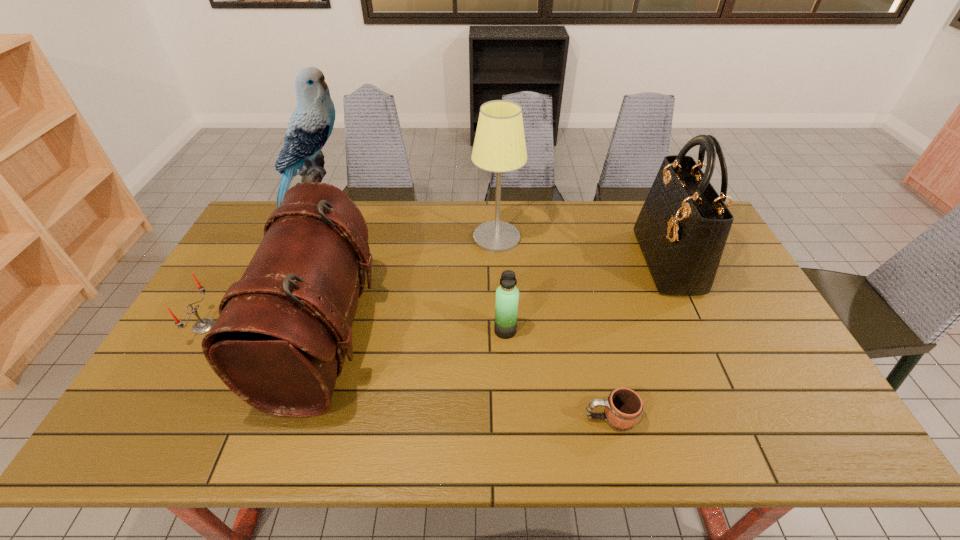
In the image, there is a desktop. Where is `vacant space at the far edge`? This screenshot has width=960, height=540. vacant space at the far edge is located at coordinates (595, 206).

In the image, there is a desktop. At what (x,y) coordinates should I click in order to perform the action: click on vacant space at the near edge. Please return your answer as a coordinate pair (x, y). The width and height of the screenshot is (960, 540). Looking at the image, I should click on (199, 442).

The width and height of the screenshot is (960, 540). In the image, there is a desktop. What are the coordinates of `free region at the left edge` in the screenshot? It's located at pyautogui.click(x=229, y=268).

Where is `free region at the right edge`? The width and height of the screenshot is (960, 540). free region at the right edge is located at coordinates (743, 320).

In the image, there is a desktop. What are the coordinates of `free space at the near left corner` in the screenshot? It's located at (180, 442).

In the image, there is a desktop. Identify the location of free space at the near right corner. Image resolution: width=960 pixels, height=540 pixels. (795, 446).

Locate an element on the screen. The width and height of the screenshot is (960, 540). vacant space that is in between the candle and the rightmost object is located at coordinates (436, 294).

Locate an element on the screen. This screenshot has width=960, height=540. unoccupied area between the satchel and the table lamp is located at coordinates (411, 287).

Locate an element on the screen. empty location between the handbag and the mug is located at coordinates (638, 340).

Identify the location of blank region between the shortest object and the parakeet. The image size is (960, 540). (464, 319).